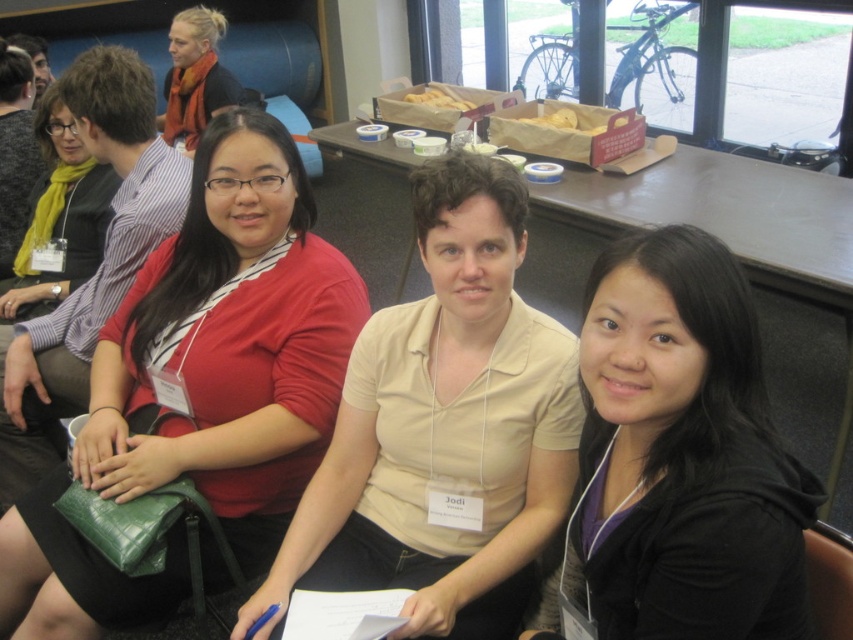
Is smooth wooden table at center positioned behind matte orange scarf at upper left?

That is False.

Between point (556, 250) and point (189, 100), which one is positioned in front?

Point (189, 100) is more forward.

At what (x,y) coordinates should I click in order to perform the action: click on smooth wooden table at center. Please return your answer as a coordinate pair (x, y). The width and height of the screenshot is (853, 640). Looking at the image, I should click on (740, 257).

Who is more forward, (294, 276) or (379, 348)?

Positioned in front is point (379, 348).

Does matte red sweater at center have a lesser height compared to beige cotton shirt at center?

No.

Who is more distant from viewer, (123, 604) or (347, 448)?

The point (347, 448) is behind.

Locate an element on the screen. matte red sweater at center is located at coordinates (229, 342).

Which of these two, beige cotton shirt at center or black matte jacket at lower right, stands taller?

beige cotton shirt at center

Who is positioned more to the right, beige cotton shirt at center or black matte jacket at lower right?

Positioned to the right is black matte jacket at lower right.

Who is more distant from viewer, (444, 584) or (695, 296)?

Point (444, 584)

I want to click on beige cotton shirt at center, so click(444, 429).